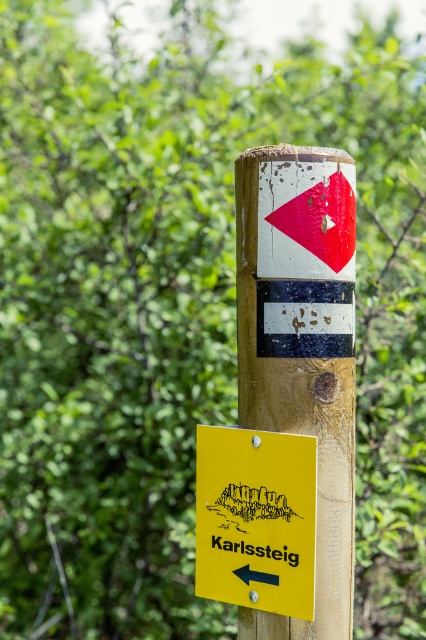
You are a hiker trying to read the yellow matte sign at lower left on the wooden post. The post has a red triangular shape pointing left at the top and a black horizontal stripe with a white rectangular section in the middle below it. Where exactly on the post is the yellow matte sign located?

The yellow matte sign at lower left is located at the lower left part of the post, specifically at the 2D coordinates point of (x=256, y=516).

You are a photographer holding a camera. You want to take a clear photo of the wooden signpost at center without any obstructions. Considering your camera is 1.29 meters away from the signpost, is the distance sufficient for a clear, focused shot?

The wooden signpost at center and camera are 1.29 meters apart. This distance is sufficient for a clear, focused photo as most cameras can focus effectively at this range.